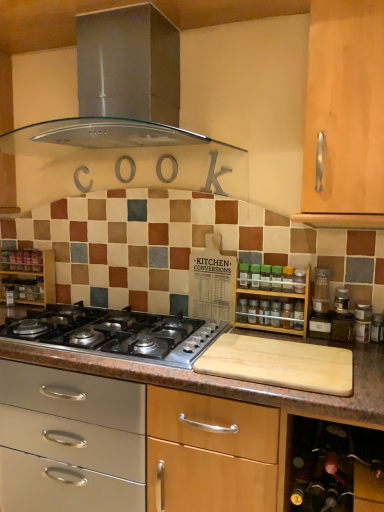
Identify the location of free location above wooden shelf at left, which ranks as the 2th shelf in front-to-back order (from a real-world perspective). Image resolution: width=384 pixels, height=512 pixels. (26, 249).